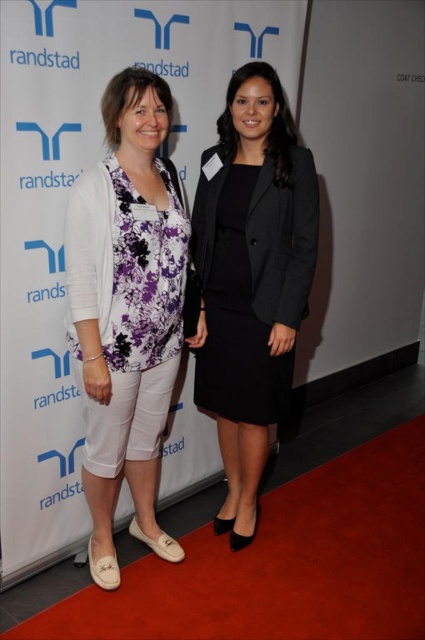
Based on the photo, is white floral blouse at center to the left of black matte blazer at center from the viewer's perspective?

Correct, you'll find white floral blouse at center to the left of black matte blazer at center.

Who is more forward, (x=150, y=358) or (x=289, y=160)?

Positioned in front is point (x=150, y=358).

Where is `white floral blouse at center`? The width and height of the screenshot is (425, 640). white floral blouse at center is located at coordinates (127, 310).

Which of these two, white floral blouse at center or black matte dress at center, stands taller?

white floral blouse at center

Does point (172, 387) come farther from viewer compared to point (243, 243)?

That is True.

Where is `white floral blouse at center`? Image resolution: width=425 pixels, height=640 pixels. white floral blouse at center is located at coordinates pyautogui.click(x=127, y=310).

Is the position of black matte blazer at center less distant than that of black matte dress at center?

That is True.

What do you see at coordinates (251, 278) in the screenshot?
I see `black matte blazer at center` at bounding box center [251, 278].

What do you see at coordinates (251, 278) in the screenshot? The width and height of the screenshot is (425, 640). I see `black matte blazer at center` at bounding box center [251, 278].

Where is `black matte blazer at center`? black matte blazer at center is located at coordinates (251, 278).